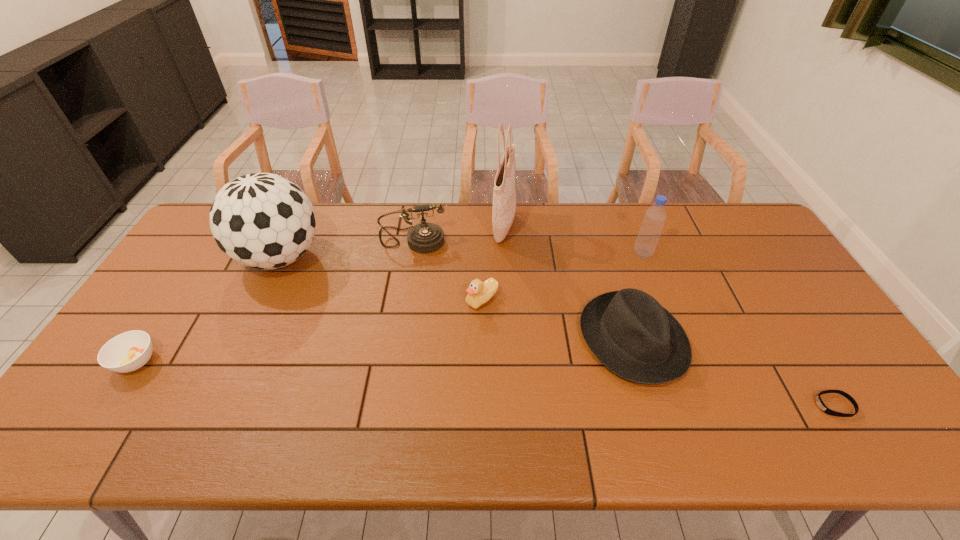
Where is `blank space located on the display of the nearest object`? This screenshot has width=960, height=540. blank space located on the display of the nearest object is located at coordinates (736, 405).

I want to click on free region located 0.220m on the display of the nearest object, so click(724, 405).

I want to click on vacant space located 0.290m on the display of the nearest object, so click(x=695, y=405).

Find the location of a particular element. shopping bag that is at the far edge is located at coordinates (504, 197).

Locate an element on the screen. Image resolution: width=960 pixels, height=540 pixels. soccer ball that is at the far edge is located at coordinates (261, 220).

At what (x,y) coordinates should I click in order to perform the action: click on telephone located at the far edge. Please return your answer as a coordinate pair (x, y). Looking at the image, I should click on (425, 237).

Image resolution: width=960 pixels, height=540 pixels. I want to click on object that is at the near edge, so click(x=820, y=403).

At what (x,y) coordinates should I click in order to perform the action: click on object at the left edge. Please return your answer as a coordinate pair (x, y). Looking at the image, I should click on click(x=129, y=351).

Identify the location of object that is at the right edge. The width and height of the screenshot is (960, 540). (820, 403).

At what (x,y) coordinates should I click in order to perform the action: click on object that is at the near right corner. Please return your answer as a coordinate pair (x, y). This screenshot has height=540, width=960. Looking at the image, I should click on (820, 403).